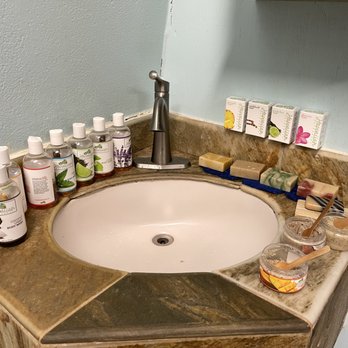
I want to click on faucet, so click(162, 106).